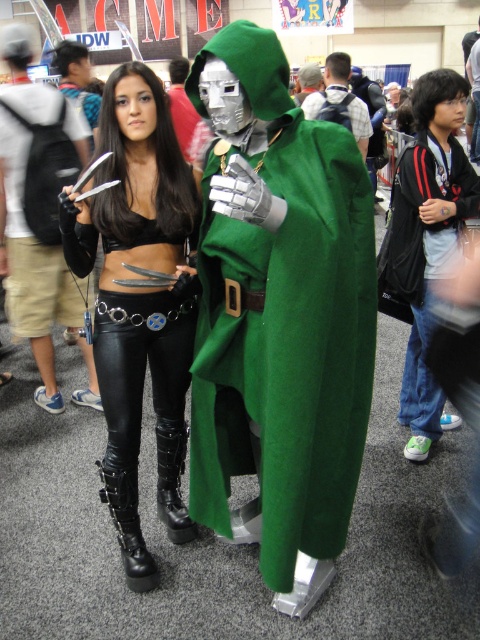
Does green woolen cloak at center appear under black leather pants at center?

Yes, green woolen cloak at center is below black leather pants at center.

Between point (305, 339) and point (113, 307), which one is positioned in front?

Point (305, 339) is more forward.

Is point (346, 486) positioned after point (112, 442)?

No, (346, 486) is in front of (112, 442).

Locate an element on the screen. The image size is (480, 640). green woolen cloak at center is located at coordinates (280, 312).